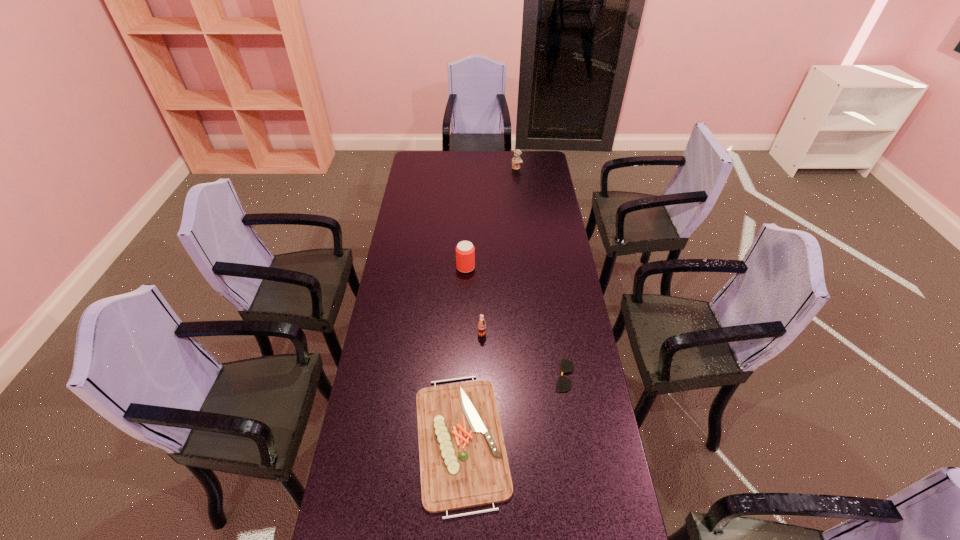
At what (x,y) coordinates should I click in order to perform the action: click on vacant space at the far right corner of the desktop. Please return your answer as a coordinate pair (x, y). This screenshot has width=960, height=540. Looking at the image, I should click on (529, 154).

Identify the location of vacant region between the farthest object and the third farthest object. This screenshot has height=540, width=960. (499, 251).

Image resolution: width=960 pixels, height=540 pixels. I want to click on vacant space in between the third farthest object and the second farthest object, so click(474, 301).

Identify the location of free space between the beer can and the second object from right to left. Image resolution: width=960 pixels, height=540 pixels. (492, 218).

Where is `free space between the farthest object and the beer can`? The height and width of the screenshot is (540, 960). free space between the farthest object and the beer can is located at coordinates (492, 218).

Image resolution: width=960 pixels, height=540 pixels. Find the location of `free space between the chopping board and the second farthest object`. free space between the chopping board and the second farthest object is located at coordinates (464, 354).

This screenshot has width=960, height=540. What are the coordinates of `vacant space that's between the farthest object and the second shortest object` in the screenshot? It's located at (489, 304).

Image resolution: width=960 pixels, height=540 pixels. I want to click on vacant point located between the second farthest object and the soda, so click(x=474, y=301).

This screenshot has height=540, width=960. Find the location of `vacant area that lies between the farthest object and the soda`. vacant area that lies between the farthest object and the soda is located at coordinates pos(499,251).

Find the location of `empty space that is in between the beer can and the rightmost object`. empty space that is in between the beer can and the rightmost object is located at coordinates (515, 321).